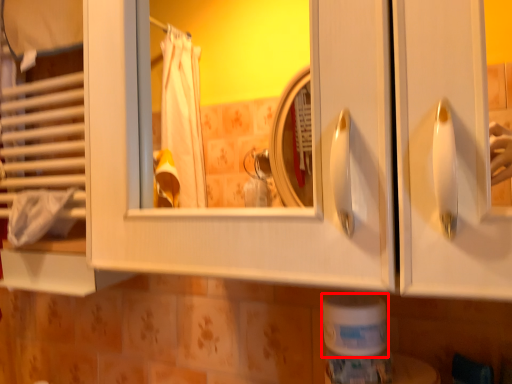
Question: From the image, what is the correct spatial relationship of toilet paper (annotated by the red box) in relation to bath towel?

Choices:
 (A) right
 (B) left

Answer: (A)